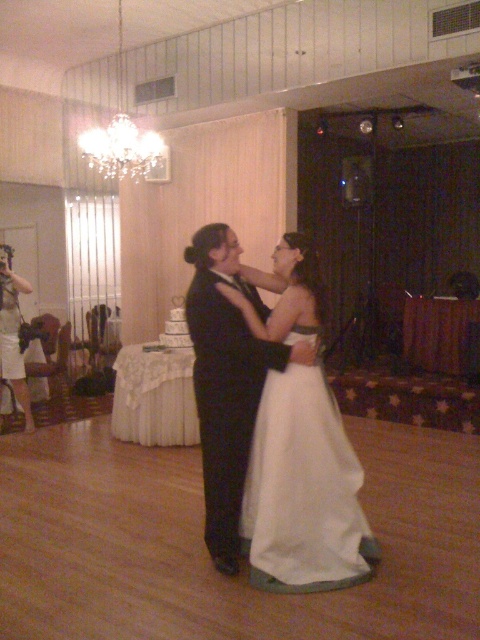
Question: Which point is farther to the camera?

Choices:
 (A) (299, 300)
 (B) (304, 522)

Answer: (A)

Question: Which object appears farthest from the camera in this image?

Choices:
 (A) satin white dress at center
 (B) white satin dress at center

Answer: (A)

Question: Is satin white dress at center smaller than white satin dress at center?

Choices:
 (A) no
 (B) yes

Answer: (A)

Question: Which point appears closest to the camera in this image?

Choices:
 (A) (265, 506)
 (B) (205, 321)

Answer: (A)

Question: From the image, what is the correct spatial relationship of satin white dress at center in relation to white satin dress at center?

Choices:
 (A) above
 (B) below

Answer: (A)

Question: Is satin white dress at center positioned behind white satin dress at center?

Choices:
 (A) no
 (B) yes

Answer: (B)